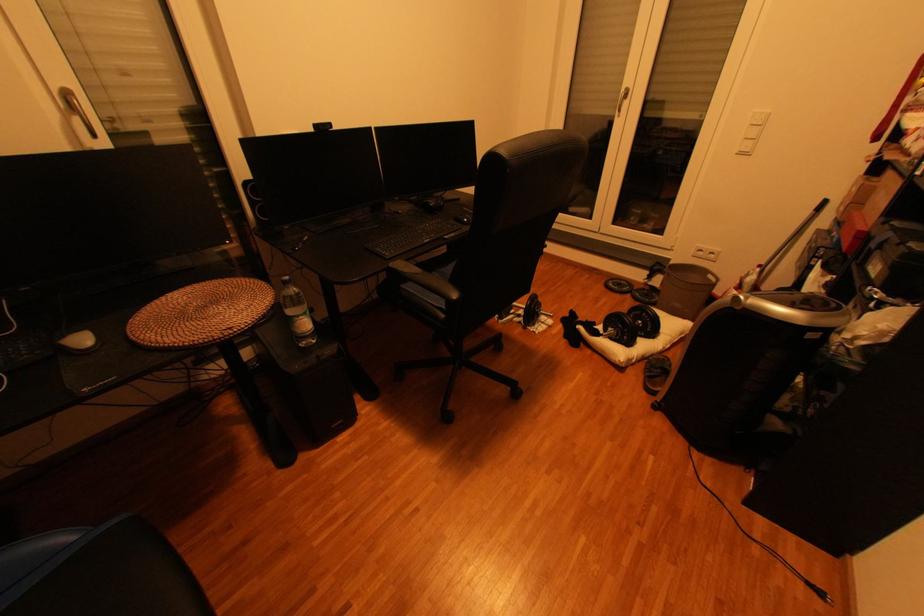
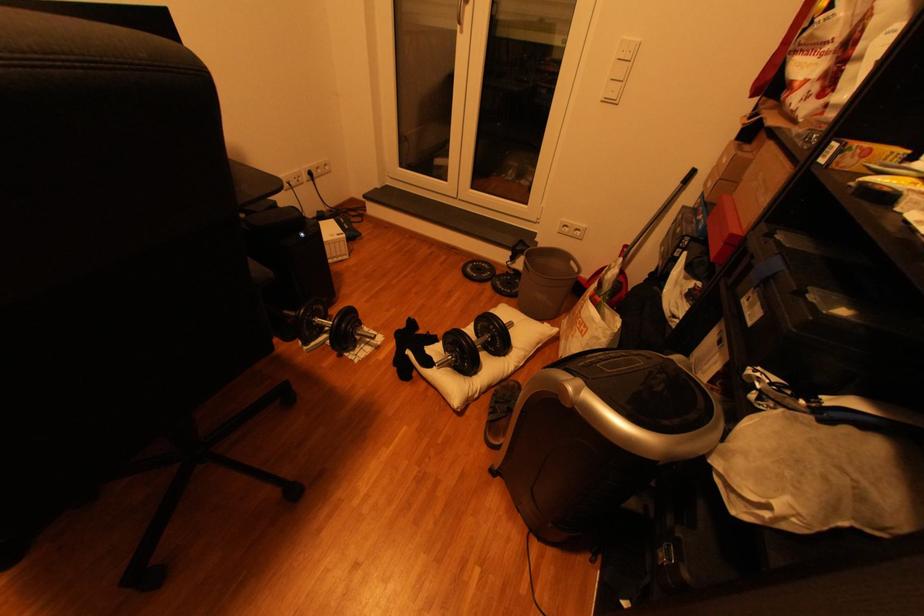
Question: The camera is either moving clockwise (left) or counter-clockwise (right) around the object. The first image is from the beginning of the video and the second image is from the end. Is the camera moving left or right when shooting the video?

Choices:
 (A) Left
 (B) Right

Answer: (A)